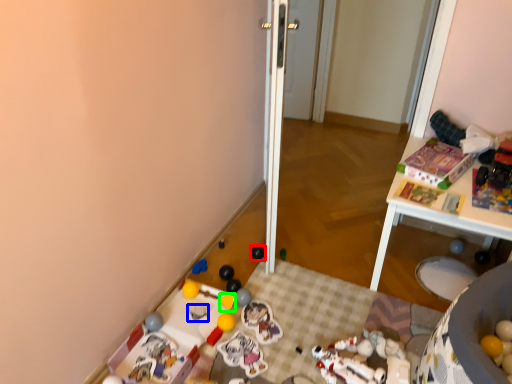
Question: Considering the real-world distances, which object is closest to toy (highlighted by a red box)? toy (highlighted by a blue box) or toy (highlighted by a green box).

Choices:
 (A) toy
 (B) toy

Answer: (B)